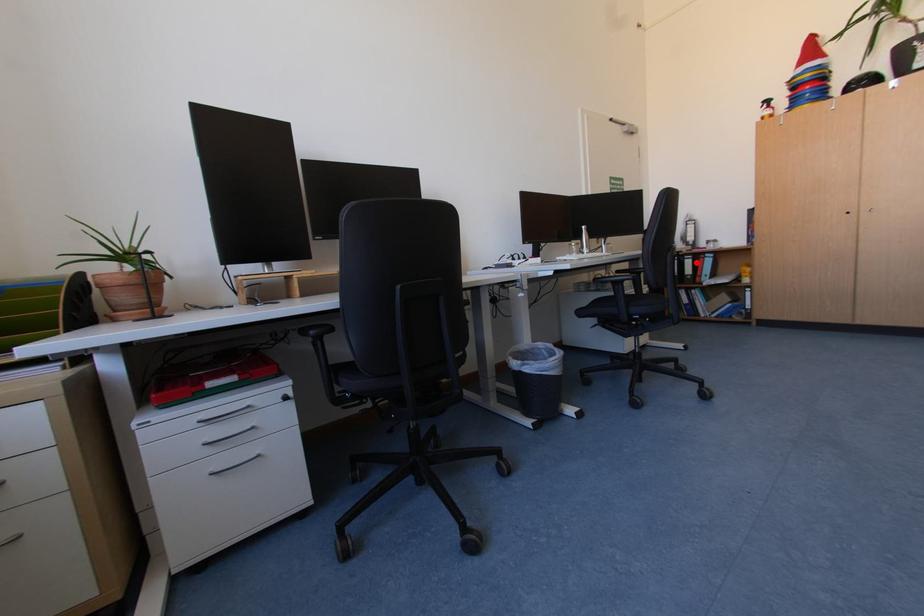
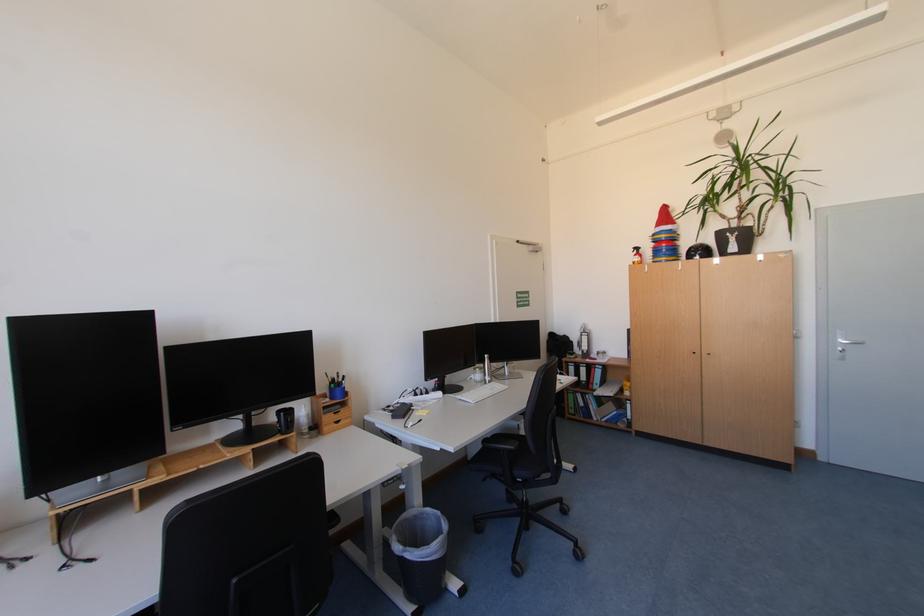
The point at the highlighted location is marked in the first image. Where is the corresponding point in the second image?

(590, 371)